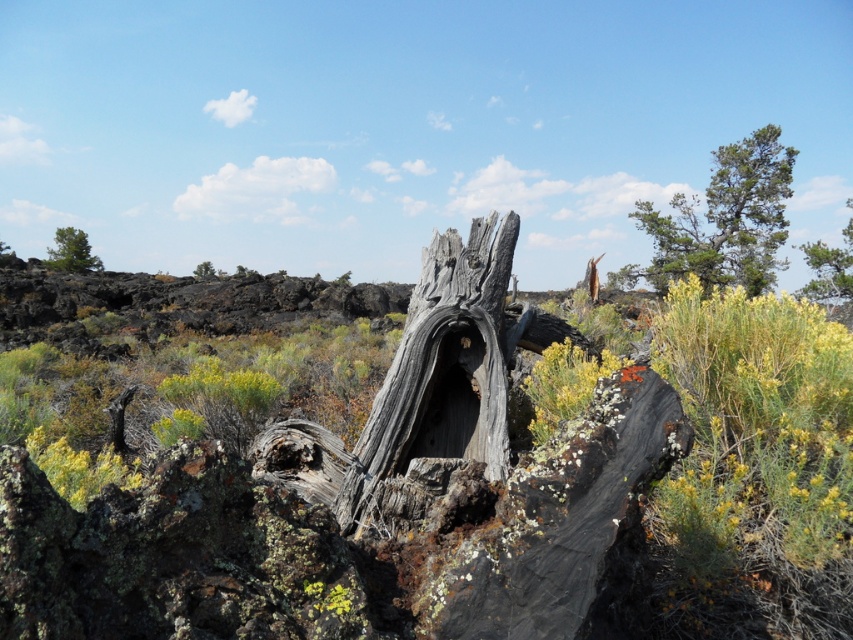
You are an explorer navigating through this rugged landscape. You need to move from the green rough bark tree at upper left to the gray rough bark tree at upper center. Which direction should you head to reach your destination?

You should head to the right to reach the gray rough bark tree at upper center since the green rough bark tree at upper left is located to its left.

You are a hiker who wants to place a small rock between the gray weathered wood at center and the gray rough bark tree at upper center. Based on their positions, which object should you place the rock closer to the left side of?

You should place the small rock closer to the left side of the gray rough bark tree at upper center because the gray weathered wood at center is positioned on the right side of it.

You are standing in the middle of the rugged landscape looking at the green rough bark tree at upper left. If you want to take a photo of it with your camera, will you need a telephoto lens to capture the entire tree in the frame?

The green rough bark tree at upper left and camera are 37.01 meters apart. Since telephoto lenses are designed to capture distant subjects while keeping them in focus and within the frame, you would need a telephoto lens to ensure the entire tree is captured in the photo from that distance.